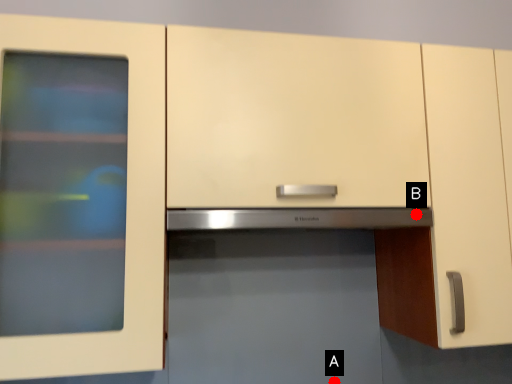
Question: Two points are circled on the image, labeled by A and B beside each circle. Which of the following is the farthest from the observer?

Choices:
 (A) A is further
 (B) B is further

Answer: (B)